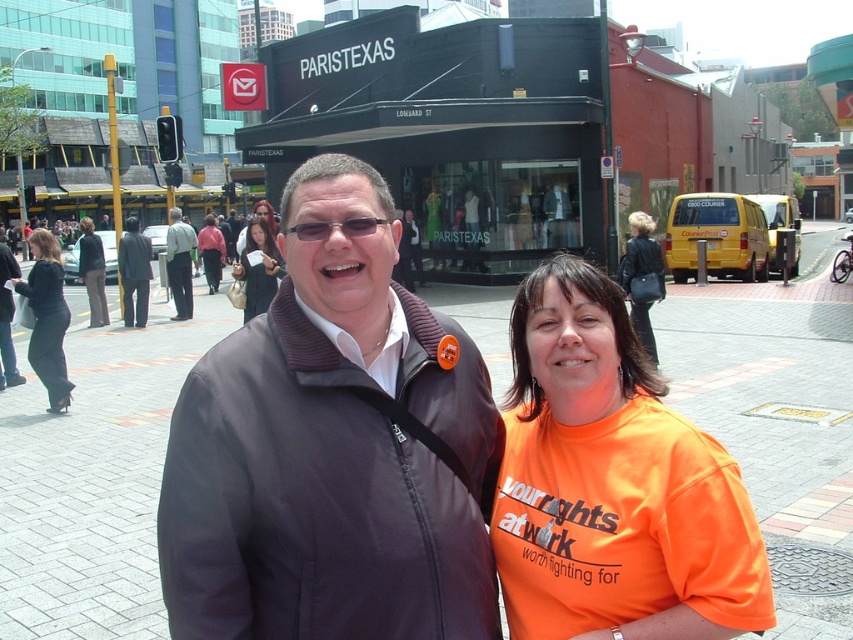
Does matte brown sweater at center have a smaller size compared to dark gray pants at center?

Indeed, matte brown sweater at center has a smaller size compared to dark gray pants at center.

Between matte brown sweater at center and dark gray pants at center, which one appears on the left side from the viewer's perspective?

Positioned to the left is dark gray pants at center.

Locate an element on the screen. The height and width of the screenshot is (640, 853). matte brown sweater at center is located at coordinates (358, 348).

Identify the location of matte brown sweater at center. The width and height of the screenshot is (853, 640). (358, 348).

Looking at this image, is black leather pants at left taller than dark gray pants at center?

No, black leather pants at left is not taller than dark gray pants at center.

Describe the element at coordinates (47, 317) in the screenshot. The width and height of the screenshot is (853, 640). I see `black leather pants at left` at that location.

Image resolution: width=853 pixels, height=640 pixels. In order to click on black leather pants at left in this screenshot , I will do `click(47, 317)`.

Find the location of a particular element. This screenshot has height=640, width=853. orange cotton t-shirt at center is located at coordinates (612, 484).

Between orange cotton t-shirt at center and matte brown sweater at center, which one appears on the left side from the viewer's perspective?

From the viewer's perspective, matte brown sweater at center appears more on the left side.

Locate an element on the screen. The image size is (853, 640). orange cotton t-shirt at center is located at coordinates (612, 484).